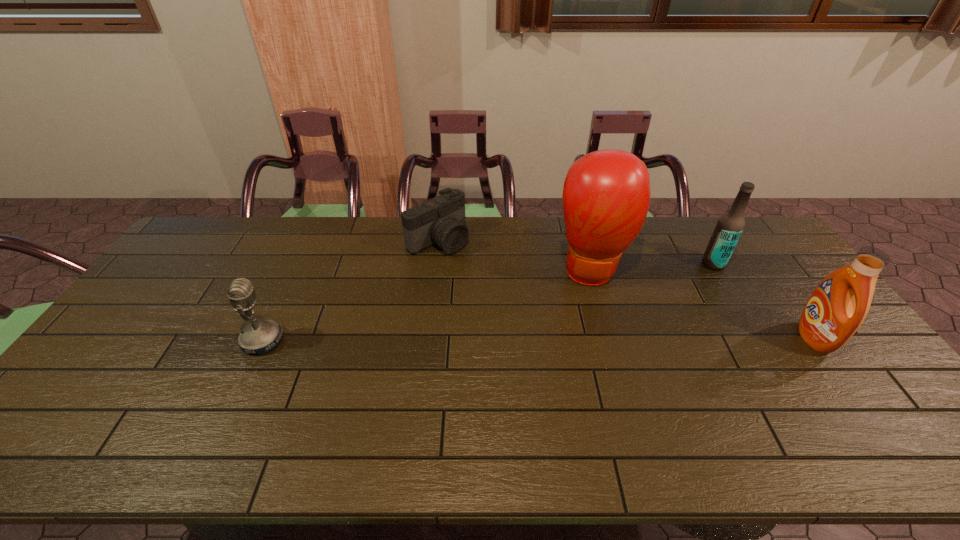
Locate an element on the screen. vacant space situated on the front-facing side of the detergent is located at coordinates (665, 338).

Find the location of a particular element. The width and height of the screenshot is (960, 540). vacant area situated 0.100m on the front-facing side of the detergent is located at coordinates (766, 338).

Locate an element on the screen. vacant region located on the striking surface of the boxing glove is located at coordinates (601, 374).

This screenshot has height=540, width=960. Identify the location of blank space located on the striking surface of the boxing glove. (601, 381).

Find the location of a particular element. This screenshot has width=960, height=540. blank space located on the striking surface of the boxing glove is located at coordinates (599, 359).

I want to click on vacant space located on the side of the beer bottle with the label, so click(x=637, y=308).

Where is `vacant space located on the side of the beer bottle with the label`? The width and height of the screenshot is (960, 540). vacant space located on the side of the beer bottle with the label is located at coordinates (664, 293).

Identify the location of free region located 0.360m on the side of the beer bottle with the label. This screenshot has width=960, height=540. (631, 312).

Locate an element on the screen. blank space located 0.140m at the lens of the shortest object is located at coordinates (485, 275).

This screenshot has height=540, width=960. I want to click on blank area located 0.350m at the lens of the shortest object, so click(532, 311).